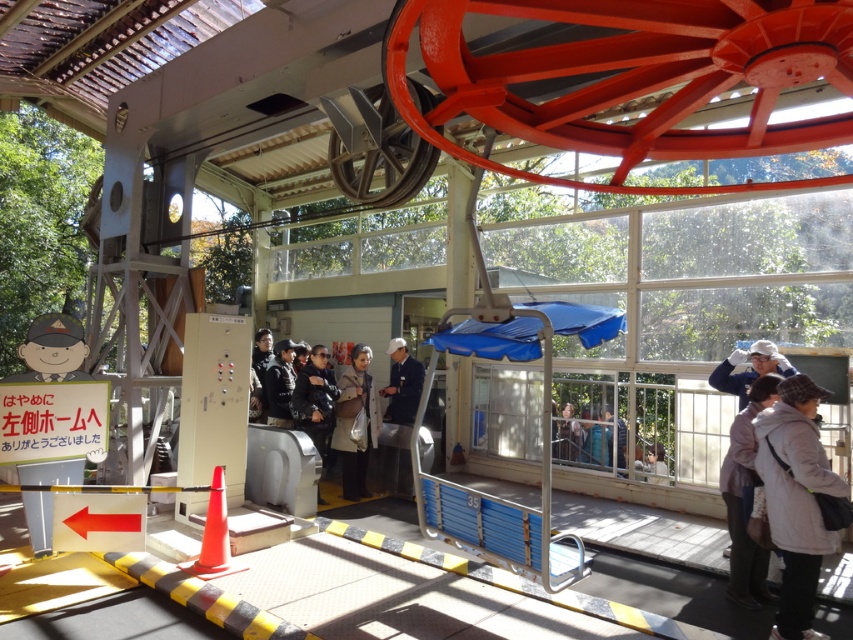
Does white fleece jacket at lower right have a lesser height compared to brown leather jacket at center?

Yes, white fleece jacket at lower right is shorter than brown leather jacket at center.

Which is behind, point (761, 477) or point (373, 396)?

The point (373, 396) is behind.

Does point (805, 408) come behind point (347, 456)?

No.

You are a GUI agent. You are given a task and a screenshot of the screen. Output one action in this format:
    pyautogui.click(x=<x>, y=<y>)
    Task: Click on the white fleece jacket at lower right
    The height and width of the screenshot is (640, 853).
    Given the screenshot: What is the action you would take?
    pyautogui.click(x=796, y=499)

Does white fleece jacket at lower right have a greater width compared to dark gray fabric coat at center?

In fact, white fleece jacket at lower right might be narrower than dark gray fabric coat at center.

From the picture: Measure the distance between point (804, 621) and camera.

A distance of 3.81 meters exists between point (804, 621) and camera.

The image size is (853, 640). I want to click on white fleece jacket at lower right, so click(x=796, y=499).

Does brown leather jacket at center come in front of dark blue uniform at center?

Yes, it is.

Can you confirm if brown leather jacket at center is shorter than dark blue uniform at center?

Correct, brown leather jacket at center is not as tall as dark blue uniform at center.

Who is more distant from viewer, [361,362] or [404,340]?

The point [404,340] is behind.

At what (x,y) coordinates should I click in order to perform the action: click on brown leather jacket at center. Please return your answer as a coordinate pair (x, y). Looking at the image, I should click on (355, 422).